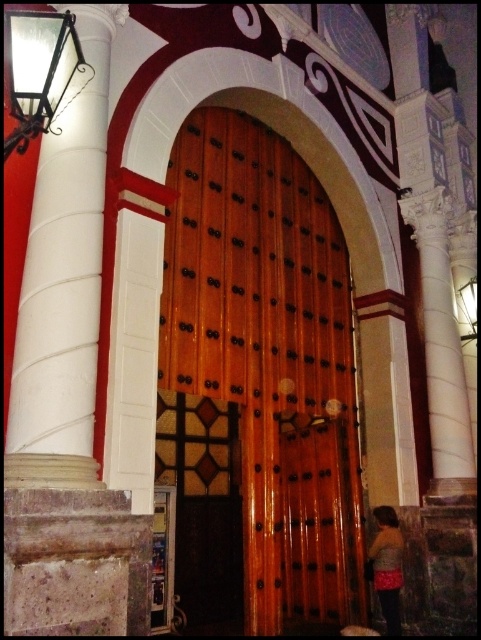
You are standing in front of the grand entrance and notice a point marked at coordinates (40, 72). What object does this point correspond to?

The point at coordinates (40, 72) corresponds to the metallic black lamp at upper left.

You are standing in front of the entrance and want to locate the wooden door at center. Which direction should you look relative to the white marble column at left?

The wooden door at center is to the right of the white marble column at left, so you should look to the right of the white marble column at left to find it.

You are standing in front of the entrance and want to locate the wooden door at center. Which direction should you face relative to the metallic black lamp at upper left?

The wooden door at center is to the right of the metallic black lamp at upper left, so you should face to the right direction relative to the metallic black lamp at upper left to locate it.